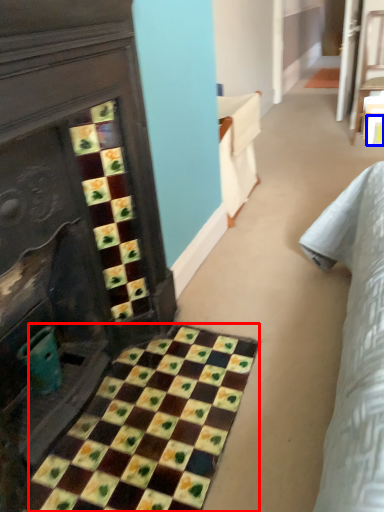
Question: Among these objects, which one is farthest to the camera, ceramic tile (highlighted by a red box) or square (highlighted by a blue box)?

Choices:
 (A) ceramic tile
 (B) square

Answer: (B)